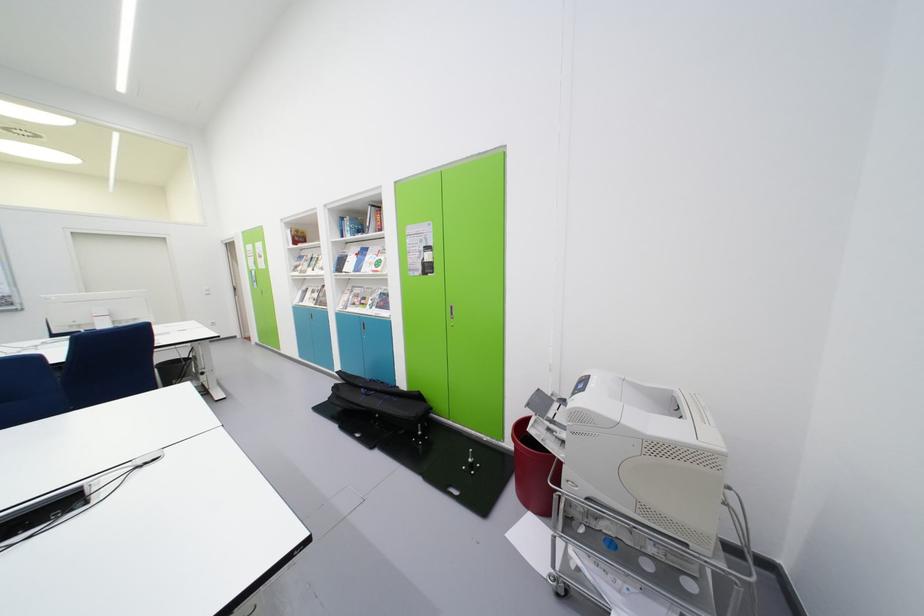
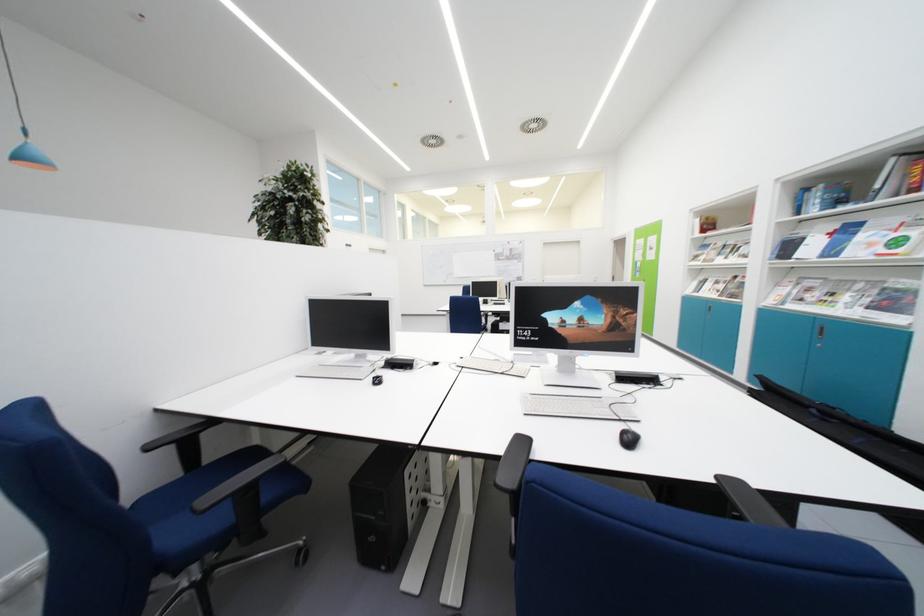
The point at (x=391, y=298) is marked in the first image. Where is the corresponding point in the second image?

(903, 294)